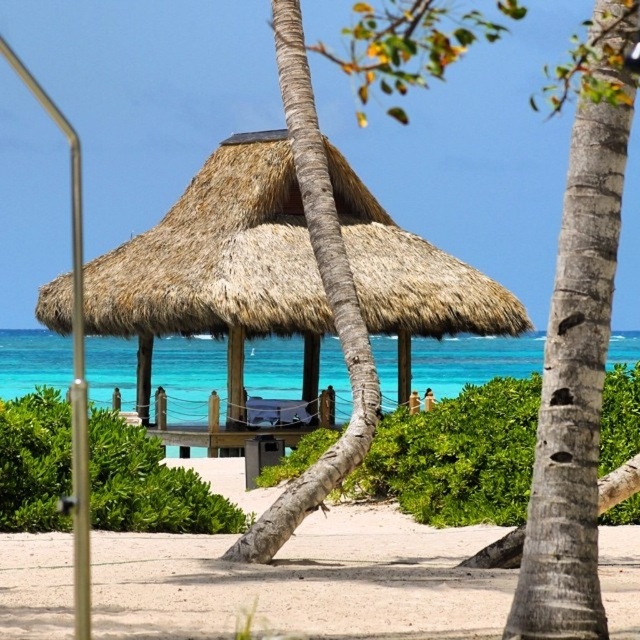
You are a visitor standing at the sandy pathway leading to the beach hut. You want to know which object is taller between the gray textured palm tree at right and the turquoise water at center. Can you tell me?

The gray textured palm tree at right is much taller than the turquoise water at center.

You are standing on the sandy pathway leading to the thatched roof structure. You want to place a 10 feet long wooden bench between the gray textured palm tree at right and the thatched roof structure. Is there enough space between them to fit the bench?

The gray textured palm tree at right is 32.39 feet away from the viewer. However, the distance between the palm tree and the thatched roof structure isn not provided in the Objects Description. Therefore, it is impossible to determine if the 10 feet long wooden bench will fit between them based on the given information.

You are a visitor approaching the thatched straw hut at center and the brown rough palm tree at center from the sandy pathway. Which object will you encounter first as you walk towards them?

The thatched straw hut at center will be encountered first because it is positioned to the left of the brown rough palm tree at center, meaning it is closer to your path.